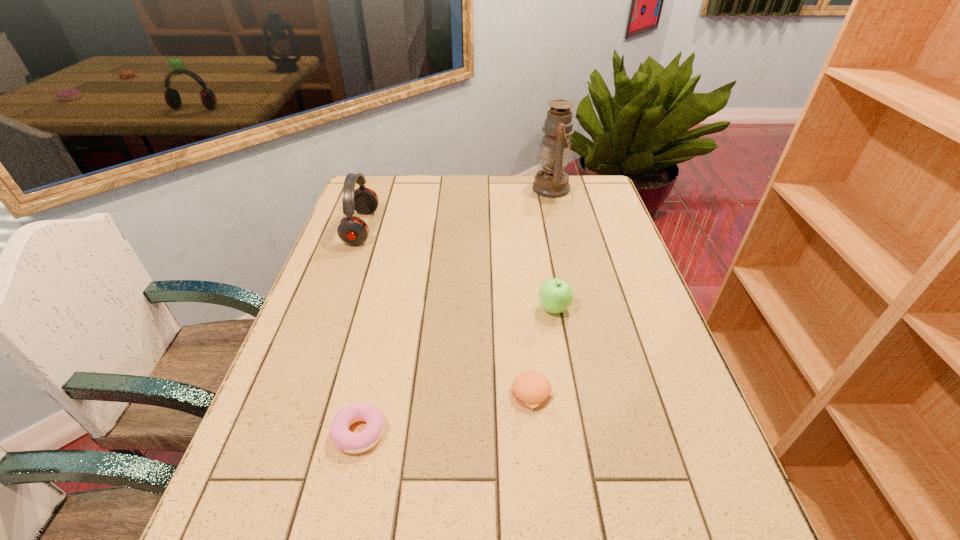
Identify the location of free region that satisfies the following two spatial constraints: 1. on the ear cups of the second farthest object; 2. on the right side of the pastry. (290, 433).

Locate an element on the screen. This screenshot has width=960, height=540. free space that satisfies the following two spatial constraints: 1. on the ear cups of the leftmost object; 2. on the back side of the fourth object from right to left is located at coordinates (290, 433).

Identify the location of free space that satisfies the following two spatial constraints: 1. on the back side of the pastry; 2. on the right side of the apple. (387, 308).